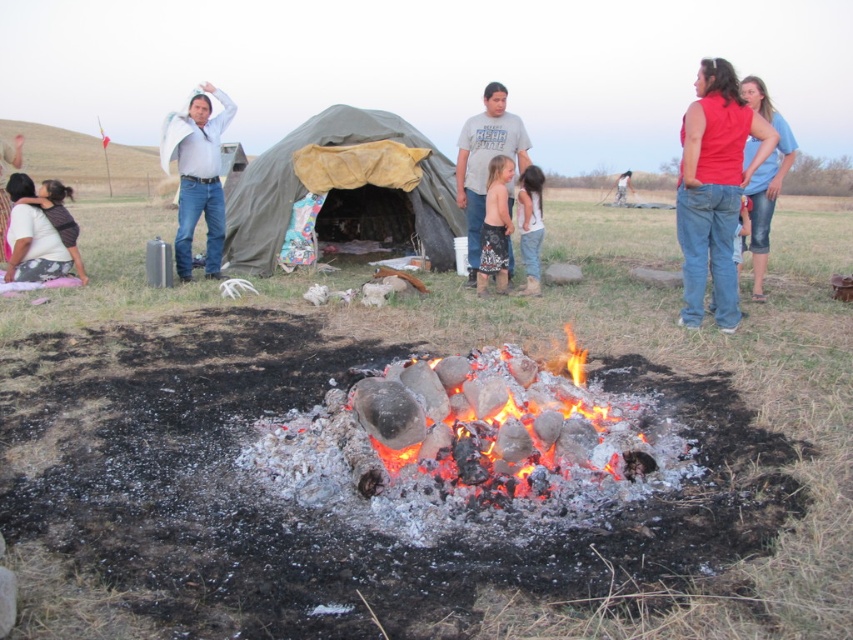
You are a photographer positioned at the edge of the field. You want to capture a photo that includes both the light blue shirt at upper left and the gray cotton shirt at center. Which shirt should you move closer to the camera to ensure both are fully visible in the frame?

The gray cotton shirt at center is behind the light blue shirt at upper left. To ensure both are fully visible, you should move the gray cotton shirt at center forward so it is no longer blocked by the light blue shirt at upper left.

You are standing at the edge of the fire pit and want to grab the red denim jeans at center. Which direction should you move to reach it from the charcoal logs at center?

The charcoal logs at center is to the left of red denim jeans at center, so you should move to the right to reach the red denim jeans at center from the charcoal logs at center.